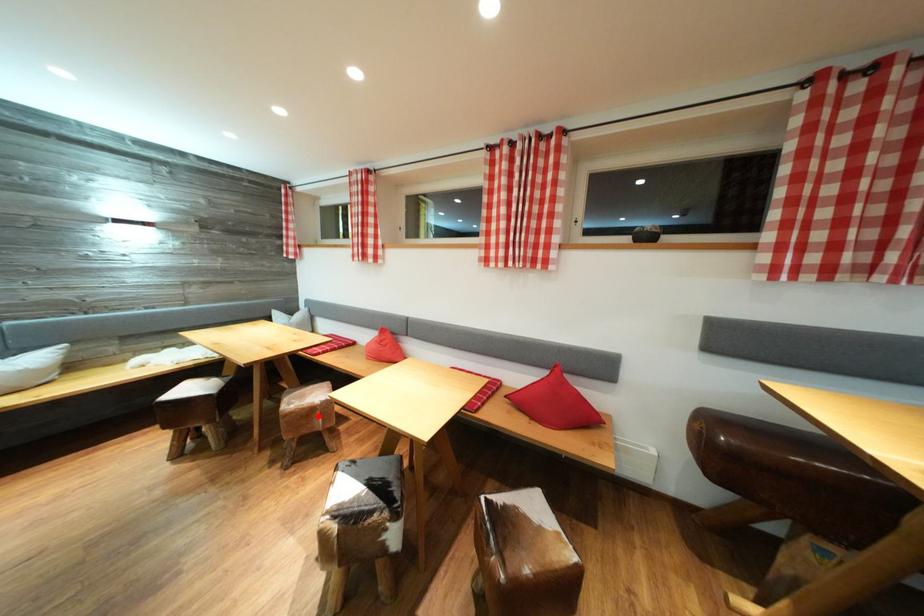
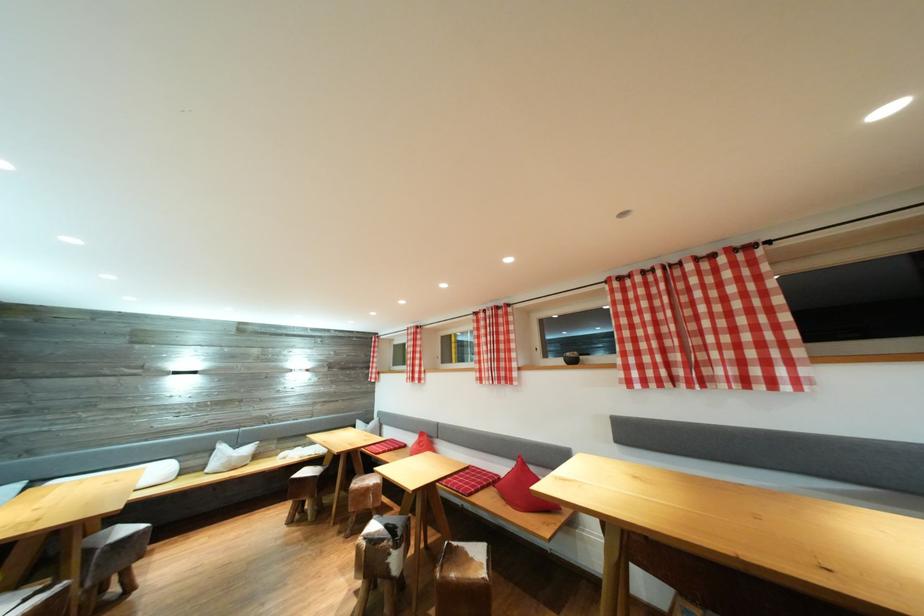
In the second image, find the point that corresponds to the highlighted location in the first image.

(373, 496)